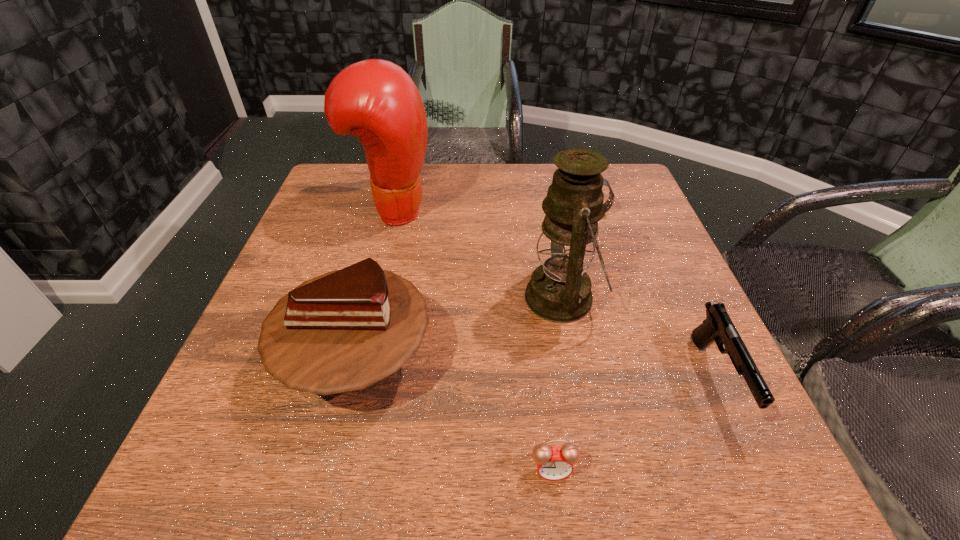
The image size is (960, 540). Identify the location of object present at the far left corner. (375, 100).

Locate an element on the screen. The height and width of the screenshot is (540, 960). free space at the far edge is located at coordinates (553, 166).

In the image, there is a desktop. Identify the location of vacant space at the near edge. The height and width of the screenshot is (540, 960). (561, 485).

This screenshot has height=540, width=960. In the image, there is a desktop. Identify the location of vacant space at the left edge. (298, 238).

You are a GUI agent. You are given a task and a screenshot of the screen. Output one action in this format:
    pyautogui.click(x=<x>, y=<y>)
    Task: Click on the vacant space at the right edge of the desktop
    
    Given the screenshot: What is the action you would take?
    coord(636,278)

Locate an element on the screen. The height and width of the screenshot is (540, 960). free space at the far left corner of the desktop is located at coordinates (x=354, y=167).

This screenshot has height=540, width=960. I want to click on free point between the rightmost object and the alarm clock, so click(x=634, y=424).

I want to click on free space between the cake and the nearest object, so click(x=455, y=416).

This screenshot has height=540, width=960. What are the coordinates of `free space between the oil lamp and the boxing glove` in the screenshot? It's located at (478, 254).

You are a GUI agent. You are given a task and a screenshot of the screen. Output one action in this format:
    pyautogui.click(x=<x>, y=<y>)
    Task: Click on the free space between the alarm clock and the watch
    The image size is (960, 540).
    Given the screenshot: What is the action you would take?
    pyautogui.click(x=571, y=342)